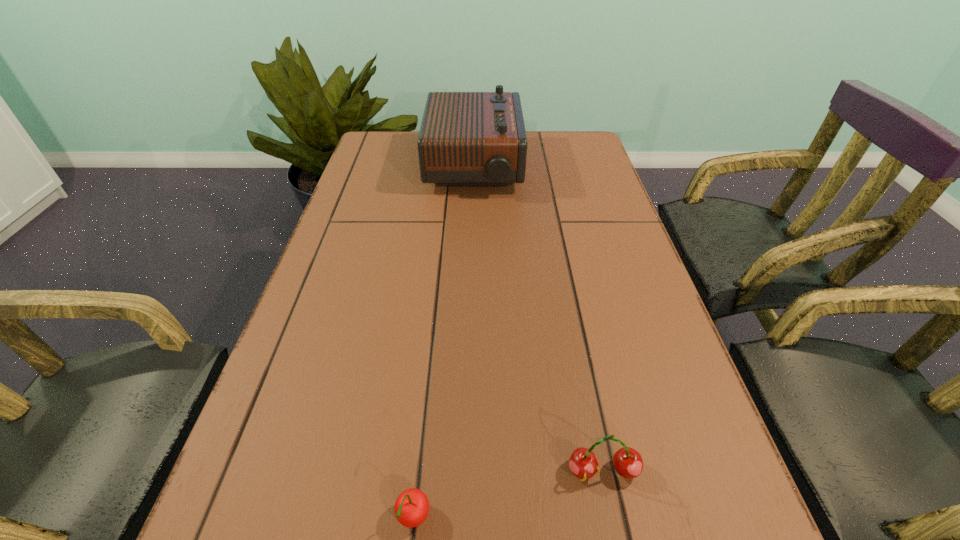
Where is `the tallest object`? the tallest object is located at coordinates (466, 138).

The image size is (960, 540). Identify the location of radio receiver. (466, 138).

This screenshot has width=960, height=540. I want to click on the right cherry, so click(x=628, y=463).

The height and width of the screenshot is (540, 960). Find the location of `the second farthest object`. the second farthest object is located at coordinates (628, 463).

Where is `free location located on the front panel of the tallest object`? free location located on the front panel of the tallest object is located at coordinates (583, 167).

At what (x,y) coordinates should I click in order to perform the action: click on free space located 0.050m with stems pointing upwards on the rightmost object. Please return your answer as a coordinate pair (x, y). Image resolution: width=960 pixels, height=540 pixels. Looking at the image, I should click on (613, 524).

The width and height of the screenshot is (960, 540). In order to click on object present at the far edge in this screenshot , I will do `click(466, 138)`.

Image resolution: width=960 pixels, height=540 pixels. In order to click on object that is at the right edge in this screenshot , I will do `click(628, 463)`.

I want to click on vacant space at the far edge of the desktop, so click(529, 136).

The width and height of the screenshot is (960, 540). In the image, there is a desktop. What are the coordinates of `vacant space at the left edge` in the screenshot? It's located at (327, 266).